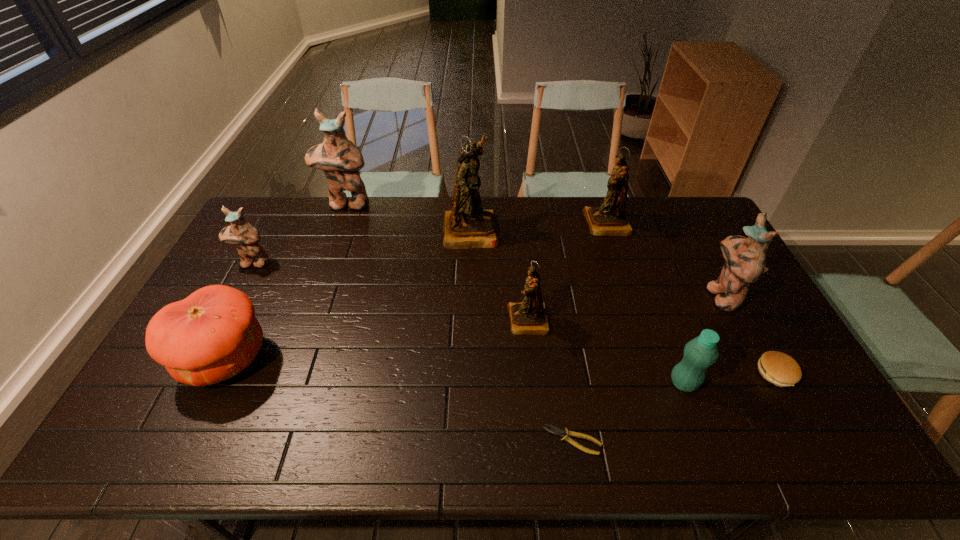
I want to click on empty location between the seventh object from right to left and the rightmost pink figurine, so [x=596, y=262].

The height and width of the screenshot is (540, 960). I want to click on free spot between the biggest pink figurine and the leftmost gold figurine, so click(x=409, y=217).

Locate an element on the screen. The width and height of the screenshot is (960, 540). unoccupied position between the rightmost pink figurine and the second nearest pink figurine is located at coordinates (487, 279).

This screenshot has width=960, height=540. I want to click on free spot between the pumpkin and the rightmost gold figurine, so click(416, 291).

This screenshot has height=540, width=960. I want to click on empty space that is in between the fourth object from left to right and the patty, so click(623, 301).

Find the location of a particular element. object that is the eighth closest to the second biggest pink figurine is located at coordinates (212, 335).

Where is `object that stands as the seventh closest to the pumpkin`? This screenshot has width=960, height=540. object that stands as the seventh closest to the pumpkin is located at coordinates (701, 352).

Select which figurine is the third closest to the ninth tallest object. Please provide its 2D coordinates. Your answer should be formatted as a tuple, i.e. [(x, y)], where the tuple contains the x and y coordinates of a point satisfying the conditions above.

[(529, 317)]

Identify which figurine is the third closest to the leftmost gold figurine. Please provide its 2D coordinates. Your answer should be formatted as a tuple, i.e. [(x, y)], where the tuple contains the x and y coordinates of a point satisfying the conditions above.

[(609, 219)]

Point out which pink figurine is positioned as the nearest to the nearest object. Please provide its 2D coordinates. Your answer should be formatted as a tuple, i.e. [(x, y)], where the tuple contains the x and y coordinates of a point satisfying the conditions above.

[(745, 258)]